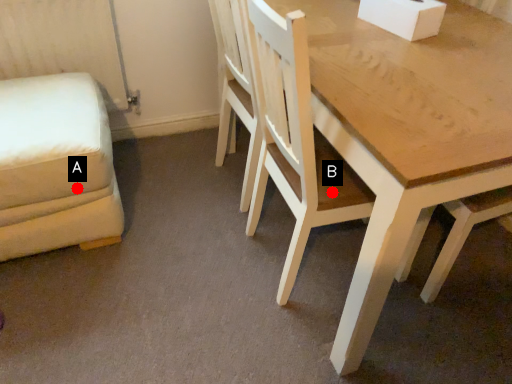
Question: Two points are circled on the image, labeled by A and B beside each circle. Among these points, which one is farthest from the camera?

Choices:
 (A) A is further
 (B) B is further

Answer: (A)